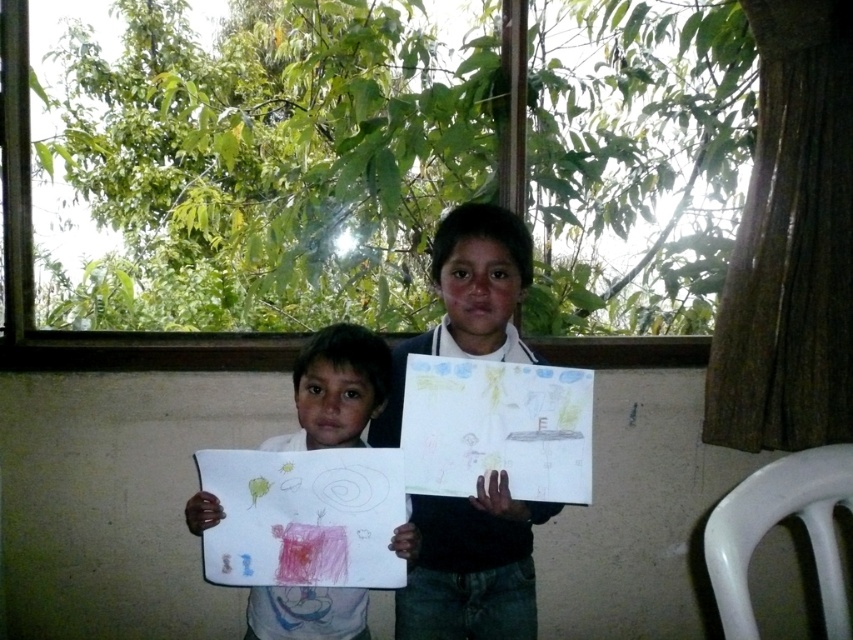
Question: Which object is farther from the camera taking this photo?

Choices:
 (A) smooth black shirt at center
 (B) white paper at center

Answer: (A)

Question: Can you confirm if smooth black shirt at center is positioned below white paper at center?

Choices:
 (A) no
 (B) yes

Answer: (A)

Question: Is smooth black shirt at center to the right of white paper at center from the viewer's perspective?

Choices:
 (A) yes
 (B) no

Answer: (A)

Question: Is the position of smooth black shirt at center more distant than that of white paper at center?

Choices:
 (A) yes
 (B) no

Answer: (A)